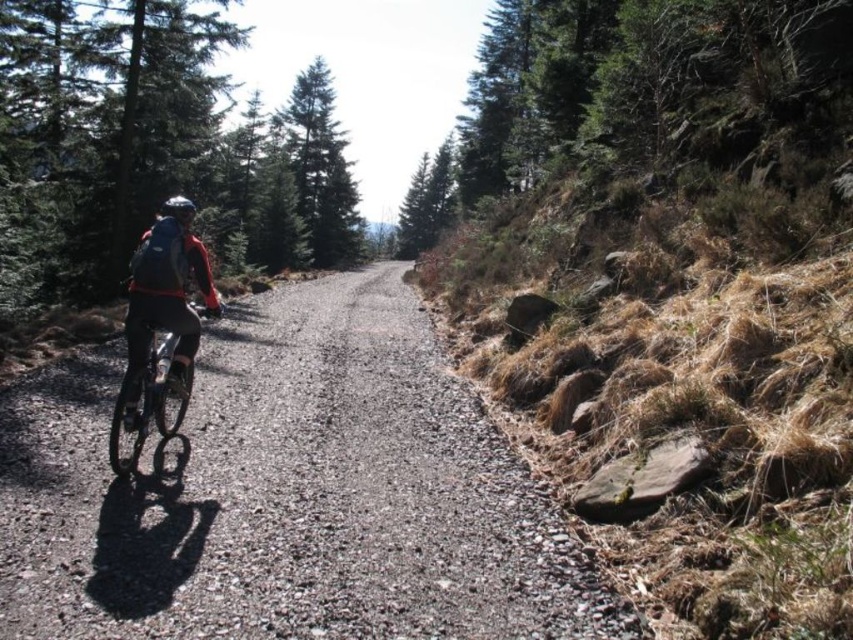
Question: Can you confirm if green textured tree at right is wider than matte black helmet at left?

Choices:
 (A) yes
 (B) no

Answer: (A)

Question: Estimate the real-world distances between objects in this image. Which object is farther from the green textured tree at right?

Choices:
 (A) matte black helmet at left
 (B) gray gravel path at center

Answer: (A)

Question: Which point is closer to the camera?

Choices:
 (A) pos(187,209)
 (B) pos(602,134)

Answer: (A)

Question: Does gray gravel path at center appear on the left side of green textured tree at right?

Choices:
 (A) yes
 (B) no

Answer: (A)

Question: Can you confirm if matte black jacket at center is bigger than green matte evergreen tree at center?

Choices:
 (A) no
 (B) yes

Answer: (A)

Question: Which point appears farthest from the camera in this image?

Choices:
 (A) (138, 285)
 (B) (544, 145)
 (C) (115, 413)

Answer: (B)